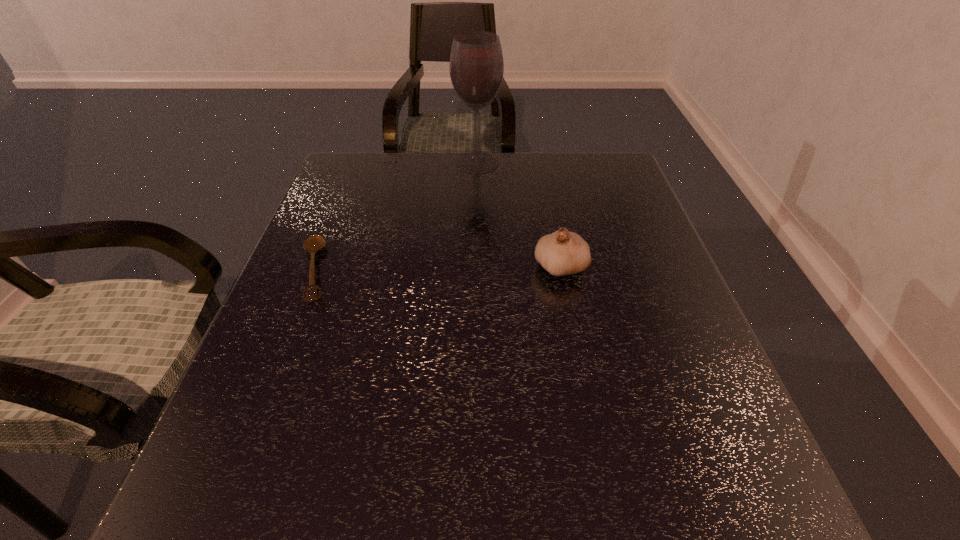
You are a GUI agent. You are given a task and a screenshot of the screen. Output one action in this format:
    pyautogui.click(x=<x>, y=<y>)
    Task: Click on the second closest object to the alcohol
    The width and height of the screenshot is (960, 540).
    Given the screenshot: What is the action you would take?
    pyautogui.click(x=314, y=243)

Where is `vacant space that satisfies the following two spatial constraints: 1. on the back side of the farthest object; 2. on the right side of the leftmost object`? vacant space that satisfies the following two spatial constraints: 1. on the back side of the farthest object; 2. on the right side of the leftmost object is located at coordinates (357, 163).